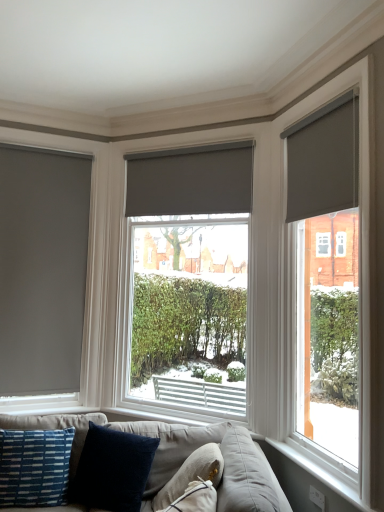
Question: Is matte gray blind at left, marked as the first window in a left-to-right arrangement, next to velvet dark blue pillow at lower center, arranged as the second pillow when viewed from the right, and touching it?

Choices:
 (A) yes
 (B) no

Answer: (B)

Question: Can you confirm if matte gray blind at left, positioned as the 3th window in right-to-left order, is bigger than velvet dark blue pillow at lower center, arranged as the second pillow when viewed from the right?

Choices:
 (A) yes
 (B) no

Answer: (B)

Question: Can you confirm if matte gray blind at left, positioned as the 3th window in right-to-left order, is positioned to the right of velvet dark blue pillow at lower center, arranged as the second pillow when viewed from the right?

Choices:
 (A) no
 (B) yes

Answer: (A)

Question: From a real-world perspective, is matte gray blind at left, positioned as the 3th window in right-to-left order, located beneath velvet dark blue pillow at lower center, arranged as the second pillow when viewed from the right?

Choices:
 (A) no
 (B) yes

Answer: (A)

Question: From a real-world perspective, does matte gray blind at left, positioned as the 3th window in right-to-left order, stand above velvet dark blue pillow at lower center, arranged as the second pillow when viewed from the right?

Choices:
 (A) no
 (B) yes

Answer: (B)

Question: Would you consider matte gray blind at left, positioned as the 3th window in right-to-left order, to be distant from velvet dark blue pillow at lower center, arranged as the second pillow when viewed from the right?

Choices:
 (A) yes
 (B) no

Answer: (A)

Question: Does matte gray roller blind at right, marked as the first window in a right-to-left arrangement, have a larger size compared to white plastic window sill at lower right?

Choices:
 (A) yes
 (B) no

Answer: (A)

Question: Is matte gray roller blind at right, acting as the third window starting from the left, turned away from white plastic window sill at lower right?

Choices:
 (A) yes
 (B) no

Answer: (B)

Question: From a real-world perspective, is matte gray roller blind at right, acting as the third window starting from the left, on top of white plastic window sill at lower right?

Choices:
 (A) no
 (B) yes

Answer: (B)

Question: Is matte gray roller blind at right, acting as the third window starting from the left, shorter than white plastic window sill at lower right?

Choices:
 (A) no
 (B) yes

Answer: (A)

Question: Could you tell me if matte gray roller blind at right, acting as the third window starting from the left, is facing white plastic window sill at lower right?

Choices:
 (A) no
 (B) yes

Answer: (A)

Question: Is white plastic window sill at lower right inside matte gray roller blind at right, marked as the first window in a right-to-left arrangement?

Choices:
 (A) yes
 (B) no

Answer: (B)

Question: From the image's perspective, would you say velvet dark blue pillow at lower center, arranged as the 3th pillow when viewed from the left, is shown under soft gray fabric couch at lower center?

Choices:
 (A) yes
 (B) no

Answer: (B)